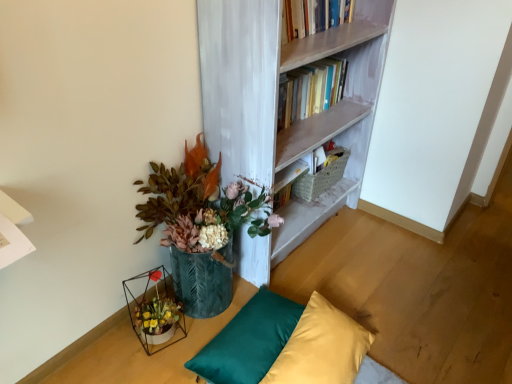
The width and height of the screenshot is (512, 384). What are the coordinates of `vacant space underneath metallic wire table at lower left (from a real-world perspective)` in the screenshot? It's located at (87, 347).